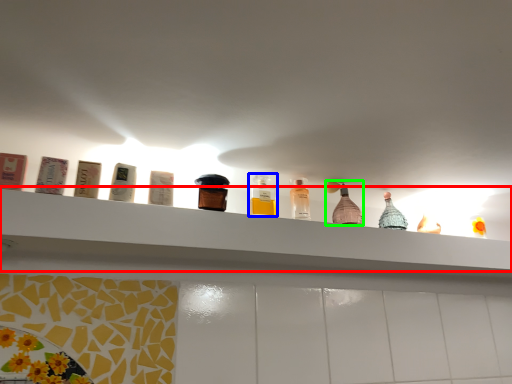
Question: Which object is the closest to the shelf (highlighted by a red box)? Choose among these: bottle (highlighted by a blue box) or bottle (highlighted by a green box).

Choices:
 (A) bottle
 (B) bottle

Answer: (B)